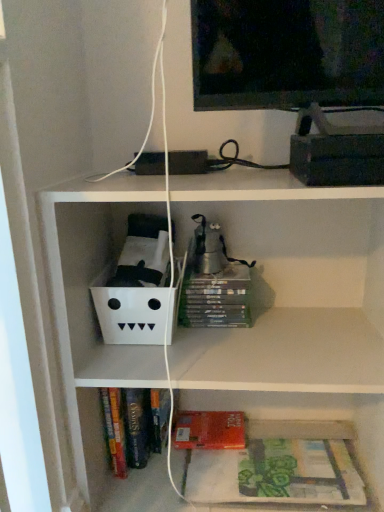
Question: From a real-world perspective, is green matte book at lower right over hardcover books at lower center?

Choices:
 (A) no
 (B) yes

Answer: (B)

Question: Considering the relative positions of green matte book at lower right and hardcover books at lower center in the image provided, is green matte book at lower right behind hardcover books at lower center?

Choices:
 (A) yes
 (B) no

Answer: (A)

Question: From the image's perspective, is green matte book at lower right above hardcover books at lower center?

Choices:
 (A) yes
 (B) no

Answer: (A)

Question: Does green matte book at lower right turn towards hardcover books at lower center?

Choices:
 (A) no
 (B) yes

Answer: (A)

Question: Considering the relative sizes of green matte book at lower right and hardcover books at lower center in the image provided, is green matte book at lower right bigger than hardcover books at lower center?

Choices:
 (A) yes
 (B) no

Answer: (B)

Question: From the image's perspective, relative to green matte book at lower right, is red matte paperback book at lower center above or below?

Choices:
 (A) below
 (B) above

Answer: (B)

Question: Considering the positions of red matte paperback book at lower center and green matte book at lower right in the image, is red matte paperback book at lower center bigger or smaller than green matte book at lower right?

Choices:
 (A) big
 (B) small

Answer: (B)

Question: From a real-world perspective, is red matte paperback book at lower center positioned above or below green matte book at lower right?

Choices:
 (A) above
 (B) below

Answer: (B)

Question: Considering the relative positions of red matte paperback book at lower center and green matte book at lower right in the image provided, is red matte paperback book at lower center to the left or to the right of green matte book at lower right?

Choices:
 (A) right
 (B) left

Answer: (B)

Question: From a real-world perspective, is green matte book at lower right positioned above or below hardcover books at lower center?

Choices:
 (A) below
 (B) above

Answer: (B)

Question: From their relative heights in the image, would you say green matte book at lower right is taller or shorter than hardcover books at lower center?

Choices:
 (A) tall
 (B) short

Answer: (B)

Question: Looking at the image, does green matte book at lower right seem bigger or smaller compared to hardcover books at lower center?

Choices:
 (A) small
 (B) big

Answer: (A)

Question: In terms of width, does green matte book at lower right look wider or thinner when compared to hardcover books at lower center?

Choices:
 (A) thin
 (B) wide

Answer: (A)

Question: In terms of size, does hardcover books at lower center appear bigger or smaller than green matte book at lower right?

Choices:
 (A) small
 (B) big

Answer: (B)

Question: Is hardcover books at lower center inside the boundaries of green matte book at lower right, or outside?

Choices:
 (A) inside
 (B) outside

Answer: (B)